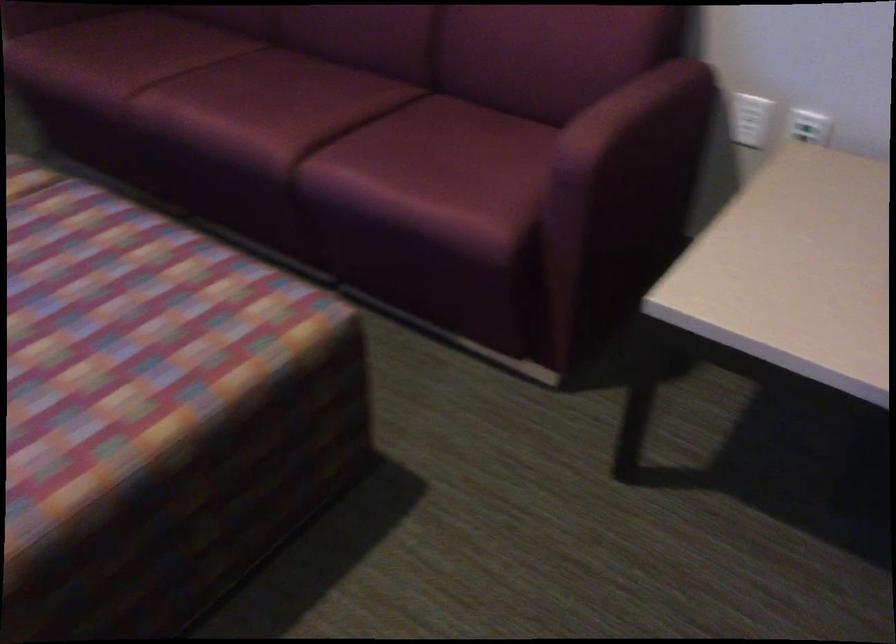
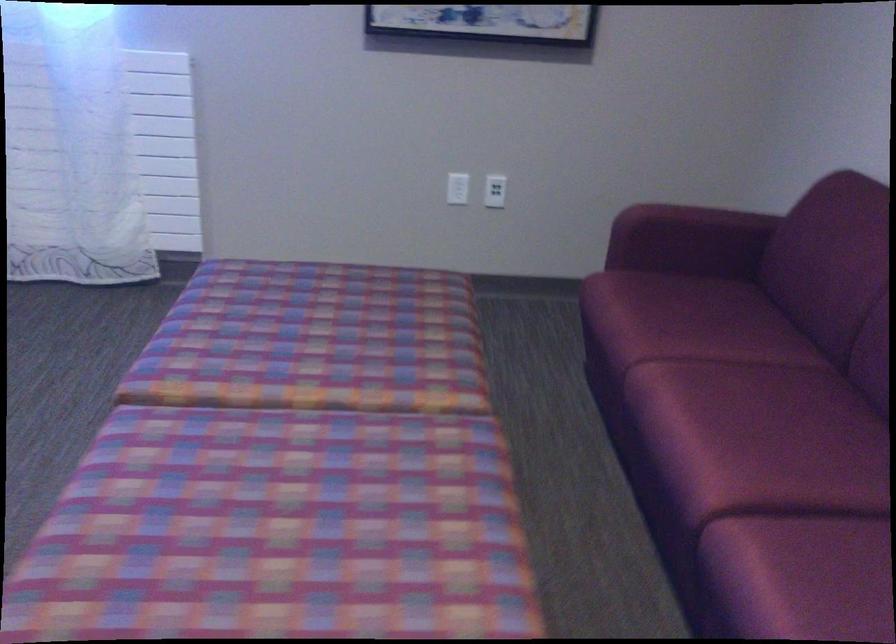
Where in the second image is the point corresponding to point 290,106 from the first image?

(764, 456)